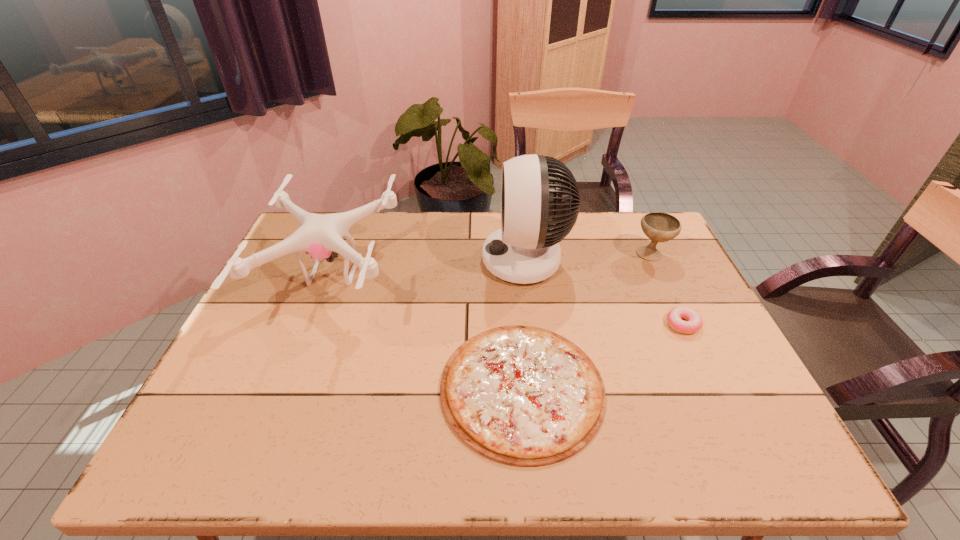
This screenshot has width=960, height=540. I want to click on vacant area that lies between the leftmost object and the second shortest object, so click(508, 299).

Where is `blank region between the third shortest object and the pizza`? Image resolution: width=960 pixels, height=540 pixels. blank region between the third shortest object and the pizza is located at coordinates (587, 321).

Where is `vacant region between the second shortest object and the shortest object`? The height and width of the screenshot is (540, 960). vacant region between the second shortest object and the shortest object is located at coordinates (602, 356).

At what (x,y) coordinates should I click in order to perform the action: click on free space that is in between the pizza and the chalice. Please return your answer as a coordinate pair (x, y). This screenshot has width=960, height=540. Looking at the image, I should click on (587, 321).

I want to click on vacant space that's between the fourth shortest object and the second shortest object, so click(x=508, y=299).

Locate an element on the screen. The height and width of the screenshot is (540, 960). empty space between the chalice and the shortest object is located at coordinates (587, 321).

The image size is (960, 540). In order to click on empty space between the fourth tallest object and the chalice in this screenshot , I will do `click(667, 289)`.

Identify which object is the fourth closest to the fan. Please provide its 2D coordinates. Your answer should be formatted as a tuple, i.e. [(x, y)], where the tuple contains the x and y coordinates of a point satisfying the conditions above.

[(320, 235)]

Find the location of a particular element. the second closest object to the doughnut is located at coordinates (524, 396).

Find the location of a particular element. This screenshot has width=960, height=540. vacant space that satisfies the following two spatial constraints: 1. on the back side of the pizza; 2. on the left side of the third shortest object is located at coordinates (511, 254).